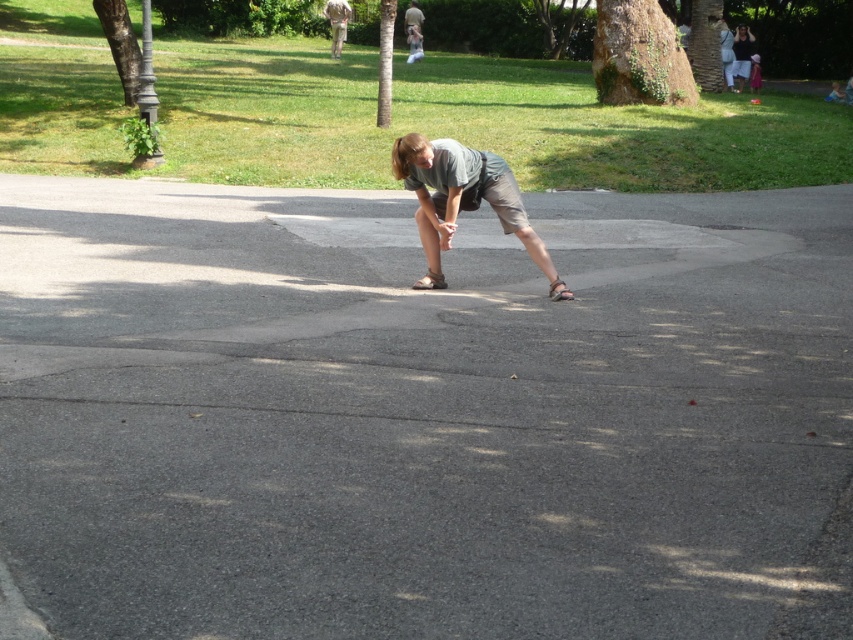
You are standing at the edge of the paved path in the park. You see the green grass at upper center and the gray cotton shorts at center. Which object is located to the left when facing the scene?

The green grass at upper center is to the left of the gray cotton shorts at center.

You are a fashion designer analyzing clothing items in the scene. You notice the gray cotton shorts at center and the matte gray shirt at upper right. Which clothing item is wider?

The gray cotton shorts at center is wider than the matte gray shirt at upper right because the gray cotton shorts at center has a greater width compared to the matte gray shirt at upper right.